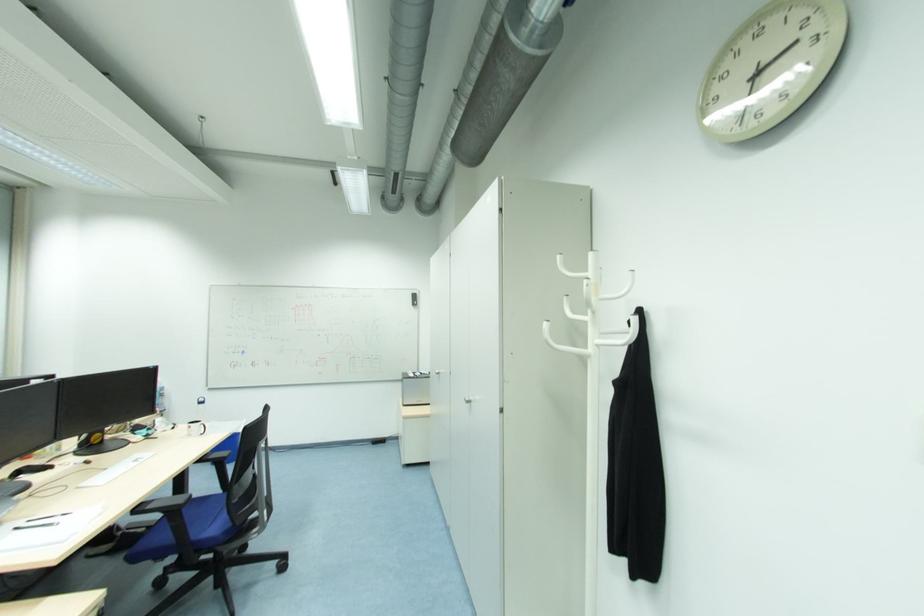
Where would you hang the white coat hook? Please return your answer as a coordinate pair (x, y).

(590, 309)